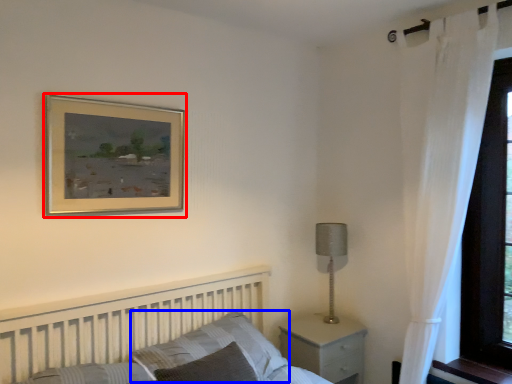
Question: Which object is further to the camera taking this photo, picture frame (highlighted by a red box) or pillow (highlighted by a blue box)?

Choices:
 (A) picture frame
 (B) pillow

Answer: (A)